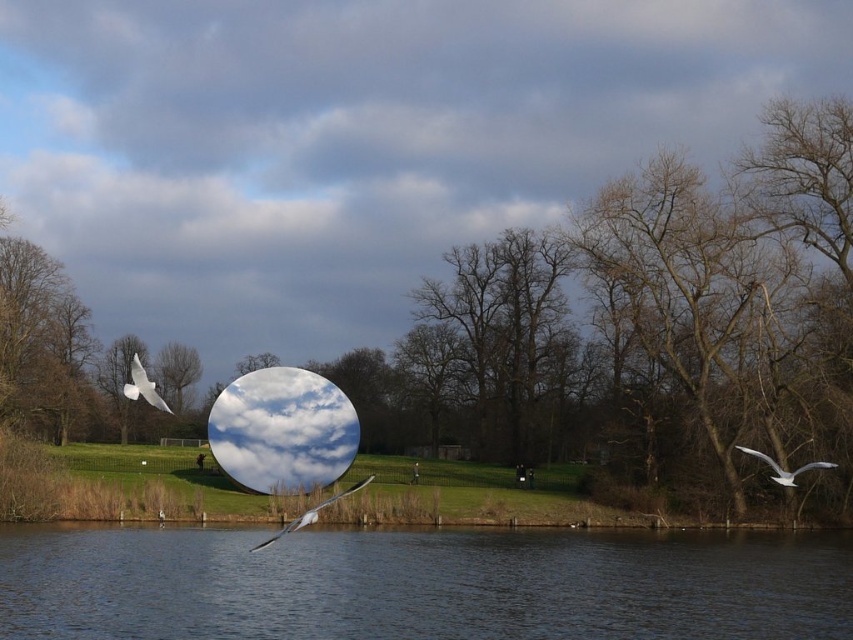
Who is taller, transparent glass water at lower center or brown matte tree at center?

brown matte tree at center

Does transparent glass water at lower center have a lesser width compared to brown matte tree at center?

No.

Does point (419, 625) come in front of point (164, 348)?

Yes.

This screenshot has height=640, width=853. In order to click on transparent glass water at lower center in this screenshot , I will do `click(421, 584)`.

Is the position of white feathered bird at lower center more distant than that of white feathered bird at upper left?

That is False.

Is white feathered bird at lower center to the right of white feathered bird at upper left from the viewer's perspective?

Indeed, white feathered bird at lower center is positioned on the right side of white feathered bird at upper left.

Who is more forward, (364,480) or (138,372)?

Point (138,372)

Locate an element on the screen. Image resolution: width=853 pixels, height=640 pixels. white feathered bird at lower center is located at coordinates (311, 513).

Can you confirm if transparent glass sphere at center is positioned above white feathered bird at lower center?

Yes, transparent glass sphere at center is above white feathered bird at lower center.

Measure the distance between transparent glass sphere at center and camera.

transparent glass sphere at center is 66.89 meters from camera.

Locate an element on the screen. transparent glass sphere at center is located at coordinates (355, 140).